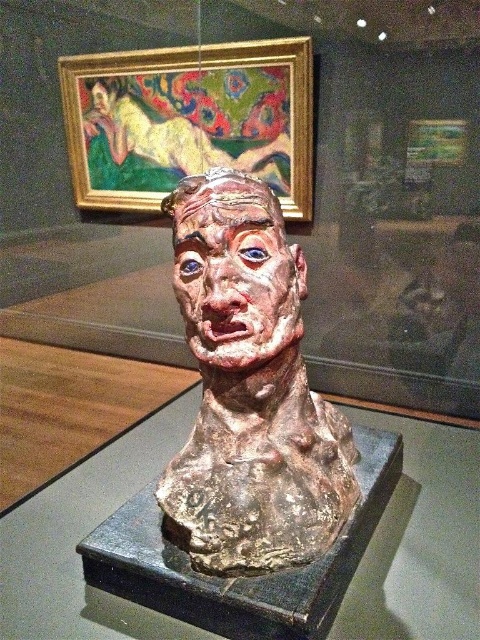
Is point (235, 208) positioned behind point (97, 96)?

No, (235, 208) is closer to viewer.

The image size is (480, 640). What are the coordinates of `matte clay face at center` in the screenshot? It's located at (237, 280).

Can you confirm if matte clay bust at center is positioned to the right of matte clay face at center?

Correct, you'll find matte clay bust at center to the right of matte clay face at center.

In the scene shown: Does matte clay bust at center have a lesser height compared to matte clay face at center?

In fact, matte clay bust at center may be taller than matte clay face at center.

Which is in front, point (266, 465) or point (274, 259)?

Point (266, 465)

Locate an element on the screen. Image resolution: width=480 pixels, height=640 pixels. matte clay bust at center is located at coordinates (250, 388).

From the picture: Does matte clay bust at center have a lesser width compared to matte clay face at upper center?

No.

Can you confirm if matte clay bust at center is positioned to the left of matte clay face at upper center?

Incorrect, matte clay bust at center is not on the left side of matte clay face at upper center.

Identify the location of matte clay bust at center. (250, 388).

Find the location of a particular element. This screenshot has height=640, width=480. matte clay bust at center is located at coordinates (250, 388).